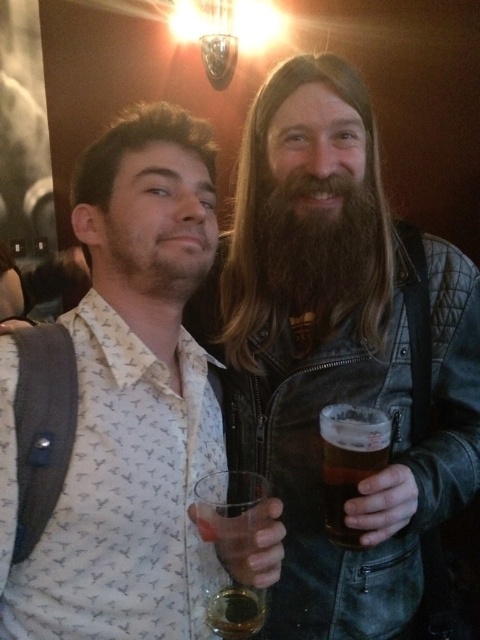
You are standing in a room and see a point at coordinates (100, 394). If you want to place a 12 inch ruler exactly at that point, will the ruler fit without overlapping the edges?

The point is 29.75 inches away from you, so placing a 12 inch ruler at that point would be possible as the distance is sufficient.

You are standing in the room and want to locate the white printed shirt at center. Which direction should you look to find it?

The white printed shirt at center is located at the coordinates point (127, 401), so you should look towards the center of the room.

You are at a party and want to grab a drink from the table next to you. There is a dark brown fuzzy beard at center and a translucent glass at lower center. Which object is closer to your left side?

The dark brown fuzzy beard at center is to the left of the translucent glass at lower center, so it is closer to your left side.